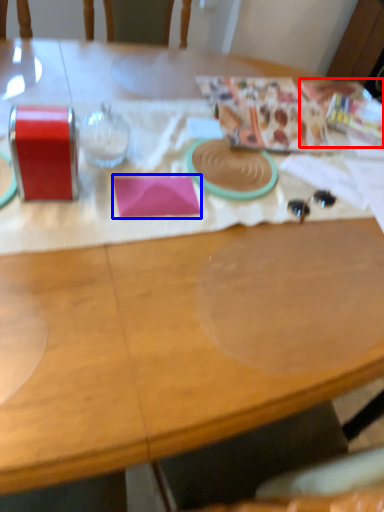
Question: Which of the following is the farthest to the observer, wrapping paper (highlighted by a red box) or notepad (highlighted by a blue box)?

Choices:
 (A) wrapping paper
 (B) notepad

Answer: (A)